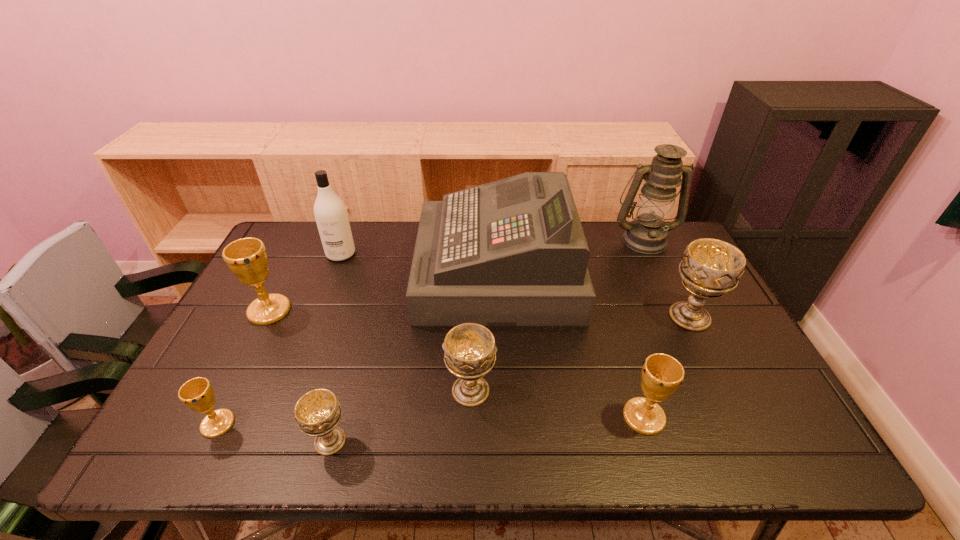
Locate an element on the screen. The image size is (960, 540). empty space that is in between the second biggest gold chalice and the oil lamp is located at coordinates (644, 328).

Where is `vacant area that lies between the second smallest gold chalice and the oil lamp`? The height and width of the screenshot is (540, 960). vacant area that lies between the second smallest gold chalice and the oil lamp is located at coordinates (644, 328).

Locate an element on the screen. free space that is in between the second smallest white chalice and the farthest gold chalice is located at coordinates (370, 350).

Locate an element on the screen. The height and width of the screenshot is (540, 960). free space between the smallest gold chalice and the gray cash register is located at coordinates (357, 348).

Find the location of a particular element. The width and height of the screenshot is (960, 540). object that ranks as the sixth closest to the smallest gold chalice is located at coordinates (662, 374).

The width and height of the screenshot is (960, 540). In order to click on the closest object to the second white chalice from right to left in this screenshot , I will do `click(512, 252)`.

The height and width of the screenshot is (540, 960). Find the location of `chalice that is the second closest to the second white chalice from right to left`. chalice that is the second closest to the second white chalice from right to left is located at coordinates (662, 374).

Select which chalice is the closest to the oil lamp. Please provide its 2D coordinates. Your answer should be formatted as a tuple, i.e. [(x, y)], where the tuple contains the x and y coordinates of a point satisfying the conditions above.

[(710, 268)]

At what (x,y) coordinates should I click in order to perform the action: click on the closest gold chalice to the leftmost white chalice. Please return your answer as a coordinate pair (x, y). Looking at the image, I should click on (197, 393).

Identify the location of gold chalice that is the nearest to the biggest gold chalice. pos(197,393).